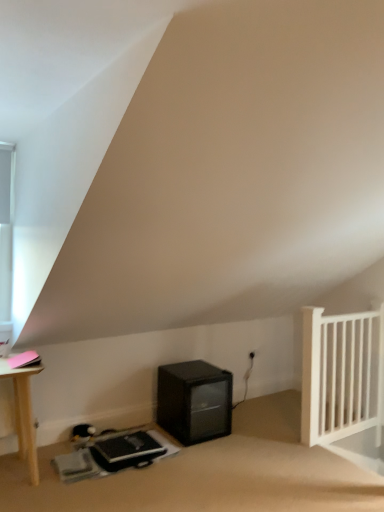
Question: Does black matte mini-fridge at lower center come in front of white glass window at upper left?

Choices:
 (A) no
 (B) yes

Answer: (A)

Question: Does black matte mini-fridge at lower center turn towards white glass window at upper left?

Choices:
 (A) yes
 (B) no

Answer: (B)

Question: Considering the relative sizes of black matte mini-fridge at lower center and white glass window at upper left in the image provided, is black matte mini-fridge at lower center shorter than white glass window at upper left?

Choices:
 (A) no
 (B) yes

Answer: (B)

Question: Are black matte mini-fridge at lower center and white glass window at upper left beside each other?

Choices:
 (A) yes
 (B) no

Answer: (B)

Question: Is black matte mini-fridge at lower center bigger than white glass window at upper left?

Choices:
 (A) yes
 (B) no

Answer: (A)

Question: From a real-world perspective, is black matte mini-fridge at lower center physically above white glass window at upper left?

Choices:
 (A) no
 (B) yes

Answer: (A)

Question: Can you confirm if black matte mini-fridge at lower center is taller than white wooden radiator at right?

Choices:
 (A) no
 (B) yes

Answer: (A)

Question: Can you confirm if black matte mini-fridge at lower center is positioned to the left of white wooden radiator at right?

Choices:
 (A) no
 (B) yes

Answer: (B)

Question: Is the depth of black matte mini-fridge at lower center less than that of white wooden radiator at right?

Choices:
 (A) no
 (B) yes

Answer: (B)

Question: Does black matte mini-fridge at lower center have a lesser height compared to white wooden radiator at right?

Choices:
 (A) yes
 (B) no

Answer: (A)

Question: Is black matte mini-fridge at lower center oriented away from white wooden radiator at right?

Choices:
 (A) yes
 (B) no

Answer: (B)

Question: From a real-world perspective, is black matte mini-fridge at lower center beneath white wooden radiator at right?

Choices:
 (A) yes
 (B) no

Answer: (A)

Question: From a real-world perspective, is white wooden radiator at right located beneath black matte mini-fridge at lower center?

Choices:
 (A) yes
 (B) no

Answer: (B)